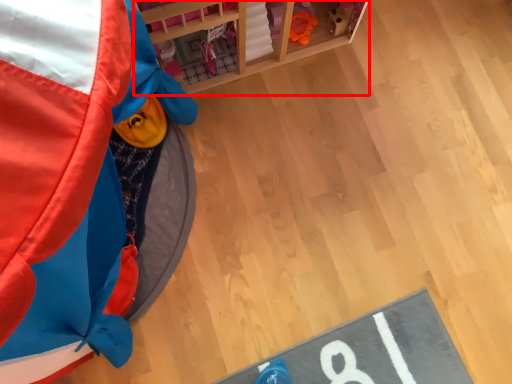
Question: In this image, where is furniture (annotated by the red box) located relative to toy?

Choices:
 (A) right
 (B) left

Answer: (A)